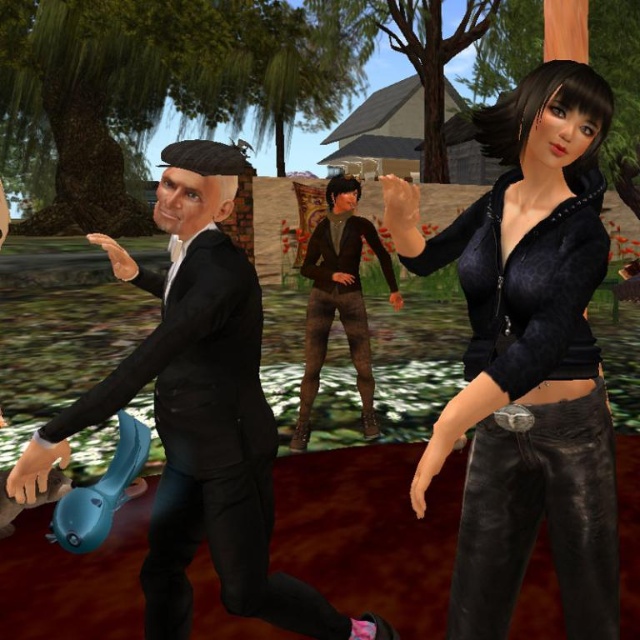
Who is lower down, velvet black jacket at center or black matte suit at left?

black matte suit at left

Is velvet black jacket at center shorter than black matte suit at left?

Indeed, velvet black jacket at center has a lesser height compared to black matte suit at left.

Is point (580, 508) in front of point (257, 307)?

Yes, point (580, 508) is closer to viewer.

This screenshot has width=640, height=640. I want to click on velvet black jacket at center, so click(x=528, y=356).

Is point (481, 467) closer to viewer compared to point (362, 333)?

Yes, it is.

Which is in front, point (545, 262) or point (332, 304)?

Point (545, 262) is in front.

Is point (424, 460) less distant than point (324, 260)?

Yes, point (424, 460) is in front of point (324, 260).

At what (x,y) coordinates should I click in order to perform the action: click on velvet black jacket at center. Please return your answer as a coordinate pair (x, y). The width and height of the screenshot is (640, 640). Looking at the image, I should click on (528, 356).

Is black matte suit at left closer to the viewer compared to brown leather pants at center?

Yes, it is.

Can you confirm if black matte suit at left is wider than brown leather pants at center?

Yes.

Where is `black matte suit at left`? black matte suit at left is located at coordinates (202, 419).